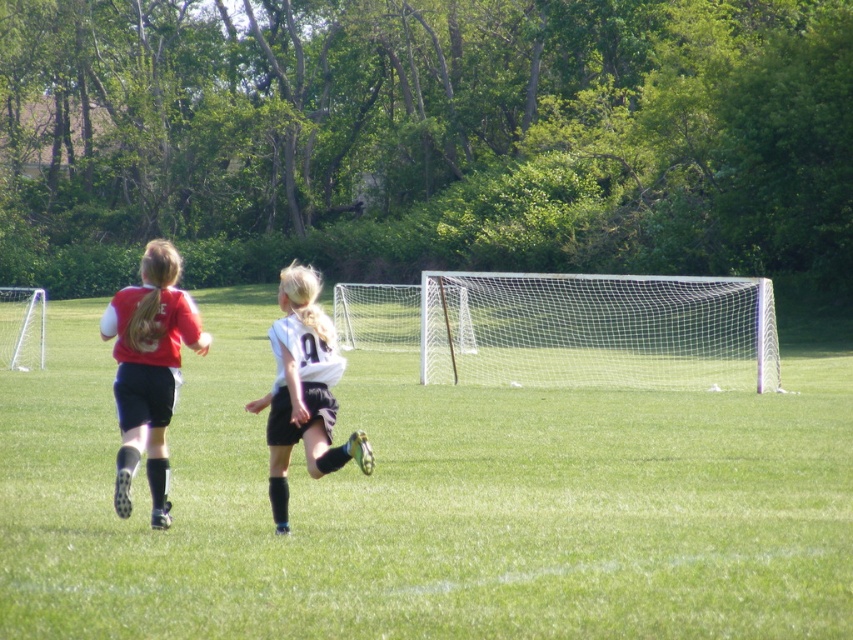
Between point (38, 566) and point (360, 449), which one is positioned behind?

Point (360, 449)

Does green grass field at center have a greater height compared to white matte jersey at center?

No, green grass field at center is not taller than white matte jersey at center.

This screenshot has width=853, height=640. I want to click on green grass field at center, so click(427, 502).

Is green grass field at center smaller than white mesh net at center?

No.

Does green grass field at center appear on the left side of white mesh net at center?

Yes, green grass field at center is to the left of white mesh net at center.

Which is behind, point (364, 516) or point (434, 349)?

Positioned behind is point (434, 349).

Find the location of a particular element. The image size is (853, 640). green grass field at center is located at coordinates (427, 502).

Can you confirm if matte red jersey at left is wider than white matte jersey at center?

Yes.

Is matte red jersey at left shorter than white matte jersey at center?

In fact, matte red jersey at left may be taller than white matte jersey at center.

Image resolution: width=853 pixels, height=640 pixels. In order to click on matte red jersey at left in this screenshot , I will do `click(149, 371)`.

The height and width of the screenshot is (640, 853). I want to click on matte red jersey at left, so click(x=149, y=371).